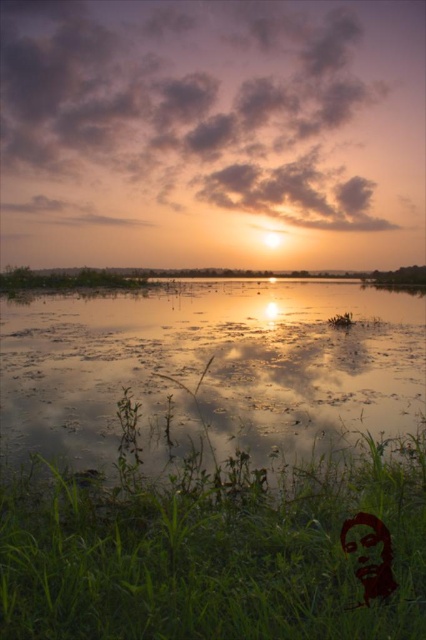
Consider the image. Does silhouette paper person at lower right lie behind smooth red face at lower right?

No, it is in front of smooth red face at lower right.

Between point (380, 525) and point (388, 560), which one is positioned behind?

Point (388, 560)

Locate an element on the screen. The image size is (426, 640). silhouette paper person at lower right is located at coordinates pyautogui.click(x=371, y=554).

Is translucent reflective water at center shorter than silhouette paper person at lower right?

No, translucent reflective water at center is not shorter than silhouette paper person at lower right.

Between translucent reflective water at center and silhouette paper person at lower right, which one appears on the left side from the viewer's perspective?

silhouette paper person at lower right

Which is behind, point (115, 442) or point (388, 573)?

The point (115, 442) is behind.

The height and width of the screenshot is (640, 426). I want to click on translucent reflective water at center, so click(x=212, y=369).

Is the position of green grass at lower left more distant than that of translucent reflective water at center?

That is False.

Does green grass at lower left appear over translucent reflective water at center?

Incorrect, green grass at lower left is not positioned above translucent reflective water at center.

The height and width of the screenshot is (640, 426). What do you see at coordinates (215, 554) in the screenshot? I see `green grass at lower left` at bounding box center [215, 554].

This screenshot has width=426, height=640. I want to click on green grass at lower left, so click(215, 554).